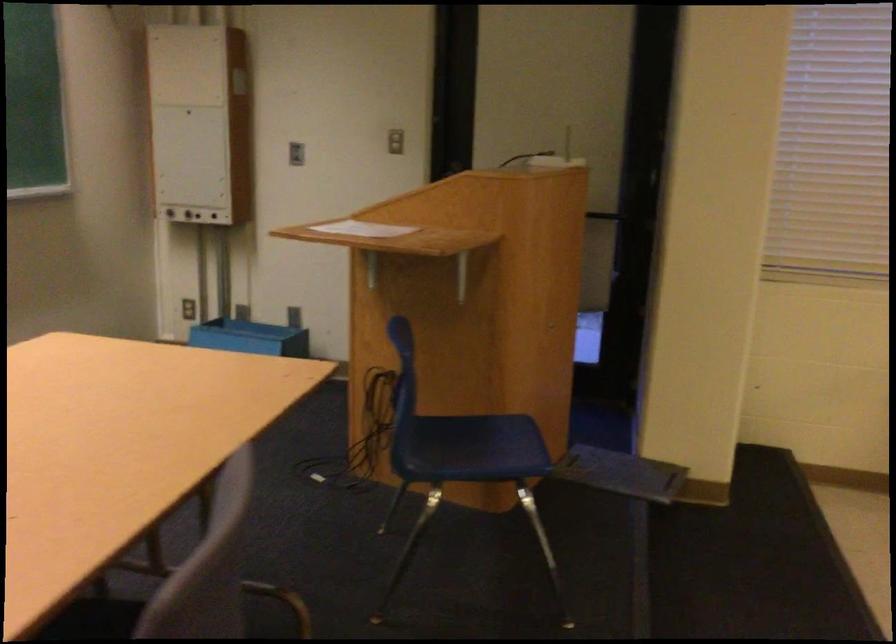
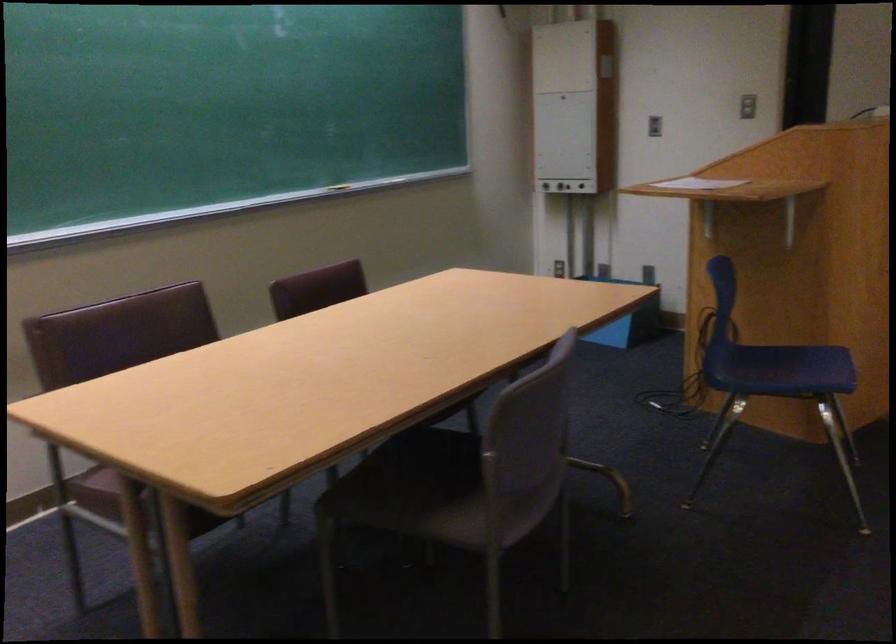
Question: I am providing you with two images of the same scene from different viewpoints. Which of the following objects are not visible in image2?

Choices:
 (A) brown chair sitting surface
 (B) magenta flower pot
 (C) blue chair sitting surface
 (D) blue plastic bin

Answer: (D)